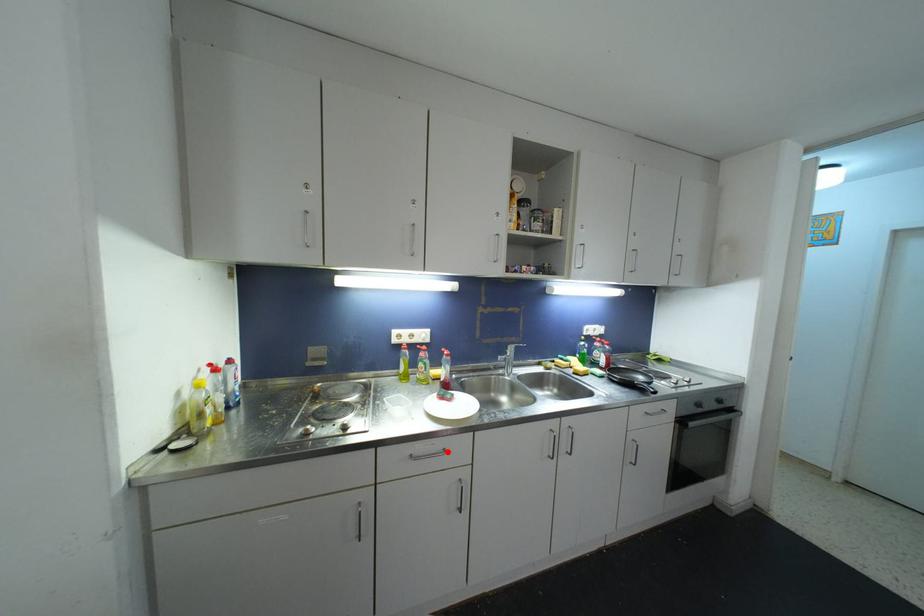
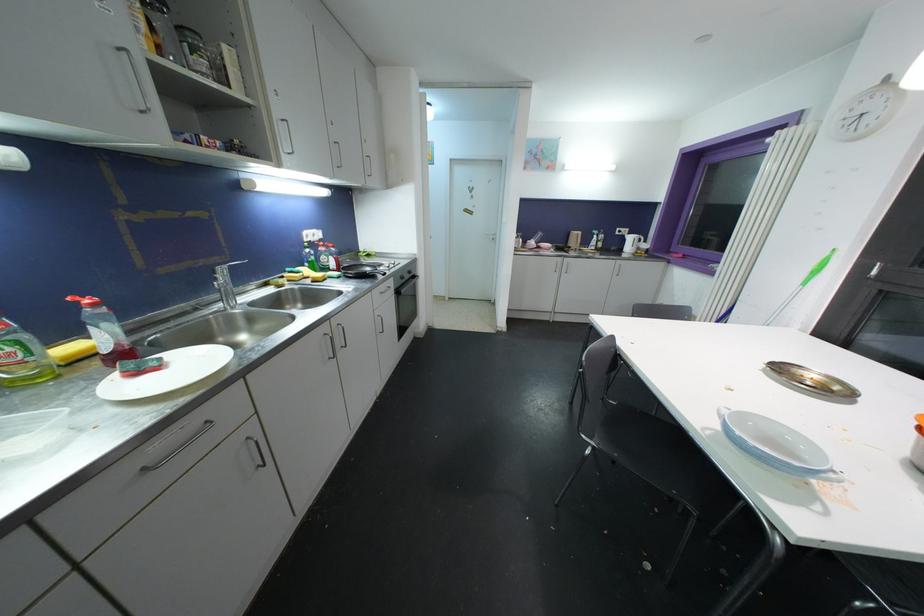
In the second image, find the point that corresponds to the highlighted location in the first image.

(210, 424)